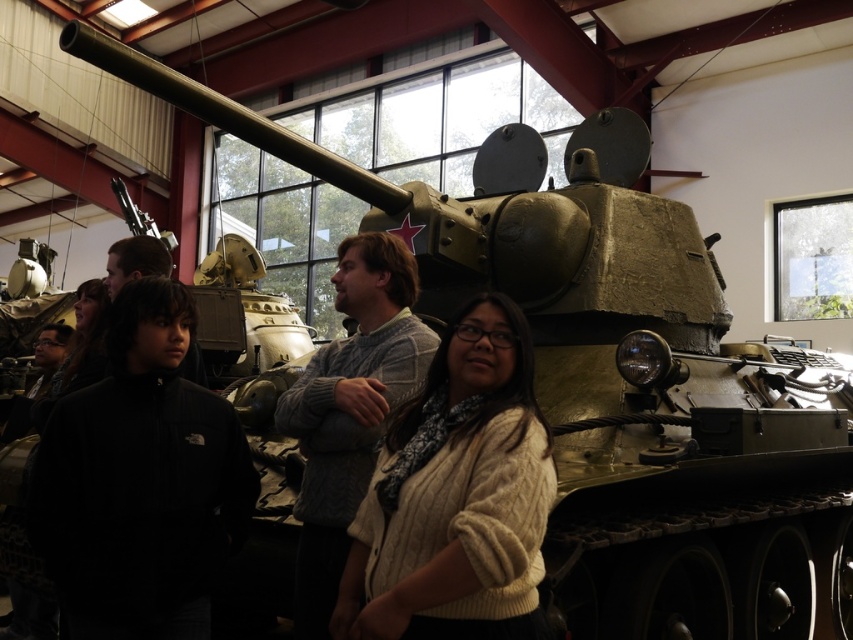
You are a visitor at the museum and want to take a photo of the olive green tank with the star emblem on its turret. However, there is an obstruction at point (x=456, y=497). What is blocking your view?

The obstruction at point (x=456, y=497) is a white knit sweater at center, which is blocking the view of the olive green tank with the star emblem on its turret.

You are a photographer trying to capture both the dark gray sweater at center and the white knit sweater at center in a single shot. Since you want to ensure both are visible, which sweater should you focus on to make sure the one farther away is in sharp focus?

The dark gray sweater at center is located above the white knit sweater at center. Since the dark gray sweater is above, it is likely closer to the camera. To ensure the farther sweater is in focus, you should focus on the white knit sweater at center.

You are a photographer trying to capture a clear shot of the white knit sweater at center without the dark gray sweater at center blocking it. Based on the scene description, what adjustment should you make to your camera position?

The white knit sweater at center is behind the dark gray sweater at center. To avoid obstruction, move your camera position slightly forward or adjust the angle to focus on the white knit sweater at center while moving around the dark gray sweater at center.